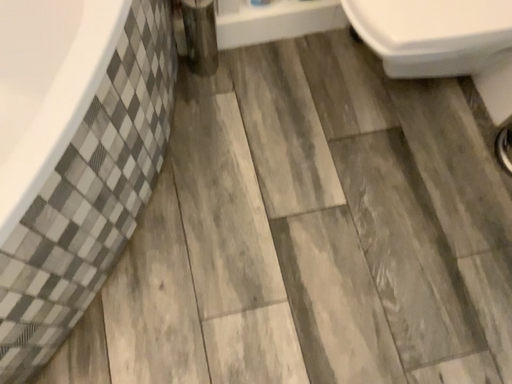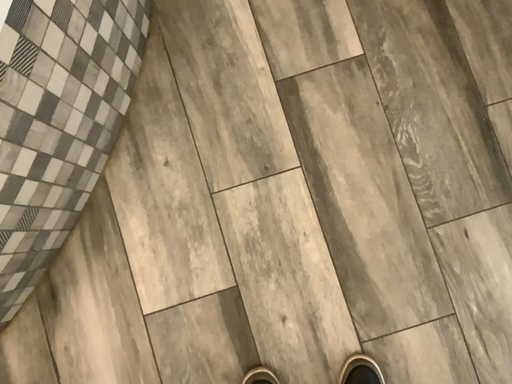
Question: Which way did the camera rotate in the video?

Choices:
 (A) rotated upward
 (B) rotated downward

Answer: (B)